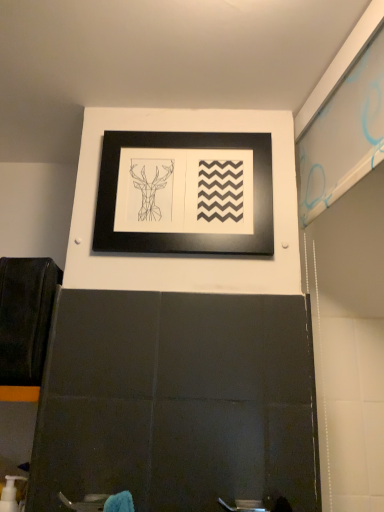
Question: Is black matte picture frame at upper center bigger than white plastic pump at lower left?

Choices:
 (A) yes
 (B) no

Answer: (A)

Question: Is black matte picture frame at upper center at the right side of white plastic pump at lower left?

Choices:
 (A) no
 (B) yes

Answer: (B)

Question: Is black matte picture frame at upper center thinner than white plastic pump at lower left?

Choices:
 (A) yes
 (B) no

Answer: (A)

Question: Can white plastic pump at lower left be found inside black matte picture frame at upper center?

Choices:
 (A) yes
 (B) no

Answer: (B)

Question: From a real-world perspective, does black matte picture frame at upper center stand above white plastic pump at lower left?

Choices:
 (A) yes
 (B) no

Answer: (A)

Question: Does black matte picture frame at upper center turn towards white plastic pump at lower left?

Choices:
 (A) no
 (B) yes

Answer: (A)

Question: Considering the relative sizes of white plastic pump at lower left and black matte picture frame at upper center in the image provided, is white plastic pump at lower left wider than black matte picture frame at upper center?

Choices:
 (A) yes
 (B) no

Answer: (A)

Question: Can you confirm if white plastic pump at lower left is bigger than black matte picture frame at upper center?

Choices:
 (A) yes
 (B) no

Answer: (B)

Question: Is white plastic pump at lower left shorter than black matte picture frame at upper center?

Choices:
 (A) yes
 (B) no

Answer: (A)

Question: Considering the relative positions of white plastic pump at lower left and black matte picture frame at upper center in the image provided, is white plastic pump at lower left to the right of black matte picture frame at upper center from the viewer's perspective?

Choices:
 (A) no
 (B) yes

Answer: (A)

Question: Is black matte picture frame at upper center surrounded by white plastic pump at lower left?

Choices:
 (A) no
 (B) yes

Answer: (A)

Question: From the image's perspective, would you say white plastic pump at lower left is shown under black matte picture frame at upper center?

Choices:
 (A) no
 (B) yes

Answer: (B)

Question: In terms of size, does white plastic pump at lower left appear bigger or smaller than black matte picture frame at upper center?

Choices:
 (A) small
 (B) big

Answer: (A)